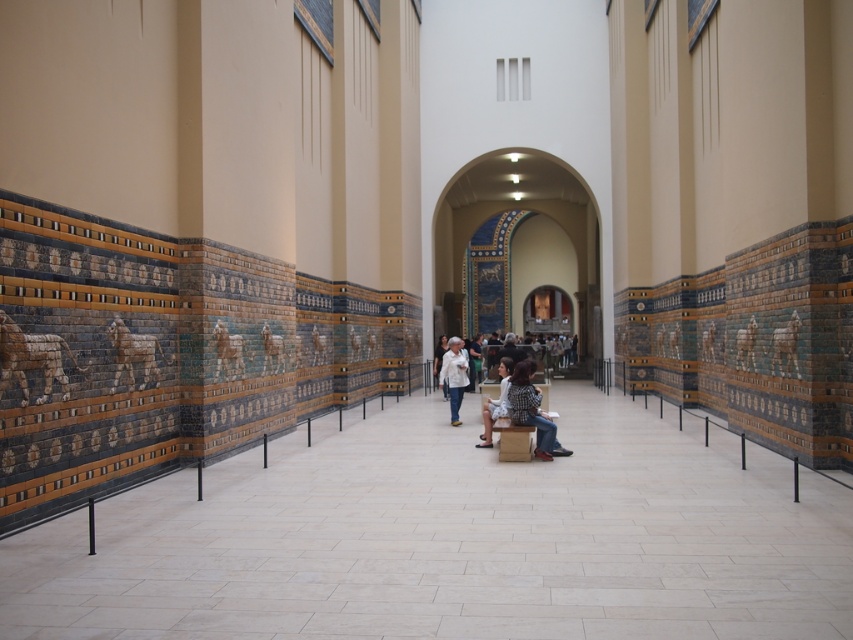
Which of these two, checkered shirt at center or white cotton shirt at center, stands taller?

With more height is checkered shirt at center.

Does checkered shirt at center have a larger size compared to white cotton shirt at center?

Correct, checkered shirt at center is larger in size than white cotton shirt at center.

Locate an element on the screen. This screenshot has width=853, height=640. checkered shirt at center is located at coordinates (532, 410).

Identify the location of checkered shirt at center. (532, 410).

Can you confirm if matte white shirt at center is smaller than white cotton shirt at center?

Correct, matte white shirt at center occupies less space than white cotton shirt at center.

Which is in front, point (514, 356) or point (445, 378)?

Positioned in front is point (445, 378).

What are the coordinates of `matte white shirt at center` in the screenshot? It's located at (518, 404).

Find the location of a particular element. This screenshot has width=853, height=640. matte white shirt at center is located at coordinates click(518, 404).

Is the position of matte white shirt at center more distant than that of white fabric dress at center?

Yes, it is.

The image size is (853, 640). Identify the location of matte white shirt at center. (518, 404).

Describe the element at coordinates (518, 404) in the screenshot. This screenshot has height=640, width=853. I see `matte white shirt at center` at that location.

Locate an element on the screen. This screenshot has width=853, height=640. matte white shirt at center is located at coordinates (518, 404).